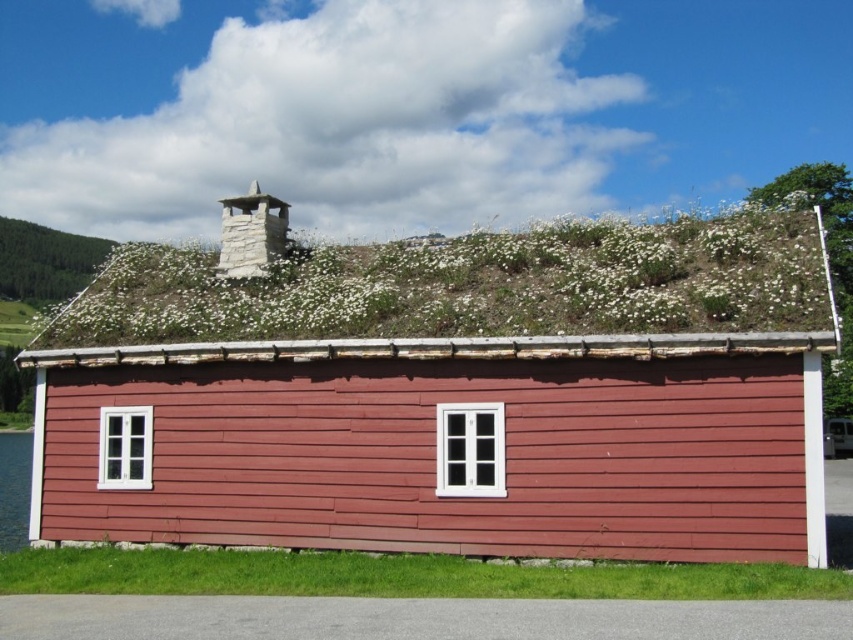
Question: Can you confirm if white grass at upper center is wider than green grass at lower center?

Choices:
 (A) yes
 (B) no

Answer: (A)

Question: Which object is the closest to the green grass at lower center?

Choices:
 (A) matte red wooden hut at center
 (B) white grass at upper center

Answer: (A)

Question: Is white grass at upper center in front of green grass at lower center?

Choices:
 (A) no
 (B) yes

Answer: (A)

Question: Is matte red wooden hut at center positioned before white grass at upper center?

Choices:
 (A) yes
 (B) no

Answer: (A)

Question: Which point is closer to the camera?

Choices:
 (A) white grass at upper center
 (B) green grass at lower center

Answer: (B)

Question: Which object appears closest to the camera in this image?

Choices:
 (A) green grass at lower center
 (B) white grass at upper center
 (C) matte red wooden hut at center

Answer: (A)